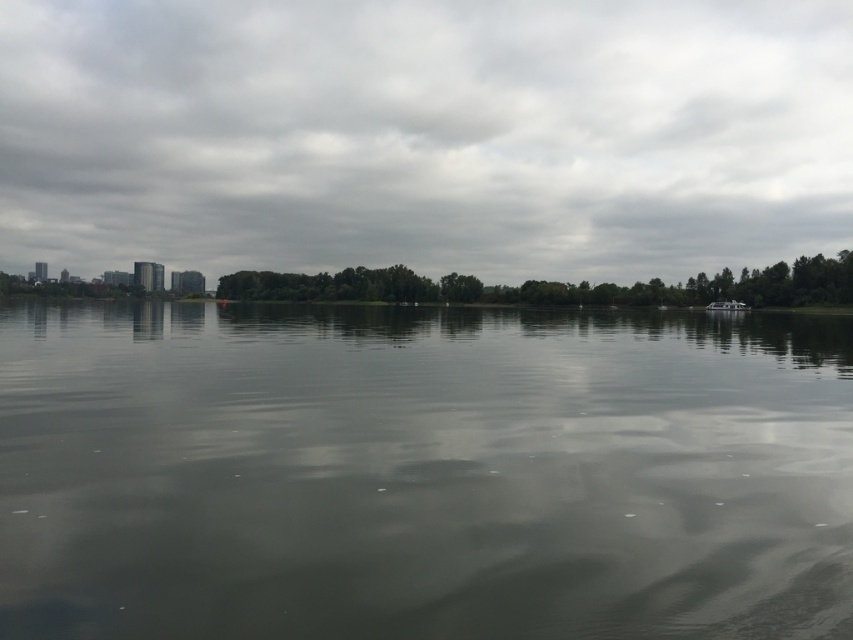
Between smooth gray water at center and cloudy sky at upper center, which one has more height?

cloudy sky at upper center

Based on the photo, is smooth gray water at center to the right of cloudy sky at upper center from the viewer's perspective?

Indeed, smooth gray water at center is positioned on the right side of cloudy sky at upper center.

You are a GUI agent. You are given a task and a screenshot of the screen. Output one action in this format:
    pyautogui.click(x=<x>, y=<y>)
    Task: Click on the smooth gray water at center
    The height and width of the screenshot is (640, 853).
    Given the screenshot: What is the action you would take?
    pyautogui.click(x=422, y=474)

Consider the image. Is green leafy trees at center positioned before white plastic boat at right?

Yes, it is.

Looking at this image, can you confirm if green leafy trees at center is shorter than white plastic boat at right?

No.

The width and height of the screenshot is (853, 640). Describe the element at coordinates (555, 285) in the screenshot. I see `green leafy trees at center` at that location.

Find the location of a particular element. This screenshot has width=853, height=640. green leafy trees at center is located at coordinates (555, 285).

Is smooth gray water at center positioned at the back of green leafy trees at center?

No.

Image resolution: width=853 pixels, height=640 pixels. What do you see at coordinates (422, 474) in the screenshot?
I see `smooth gray water at center` at bounding box center [422, 474].

Find the location of a particular element. This screenshot has width=853, height=640. smooth gray water at center is located at coordinates (422, 474).